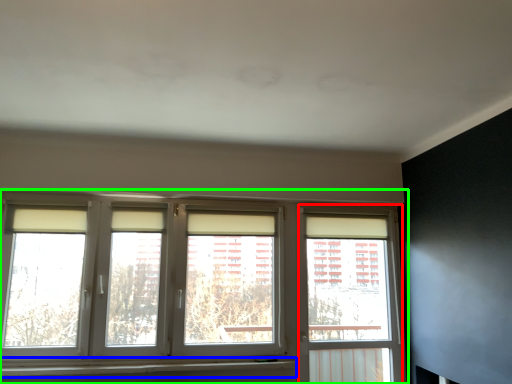
Question: Which object is the closest to the window frame (highlighted by a red box)? Choose among these: window sill (highlighted by a blue box) or window (highlighted by a green box).

Choices:
 (A) window sill
 (B) window

Answer: (B)